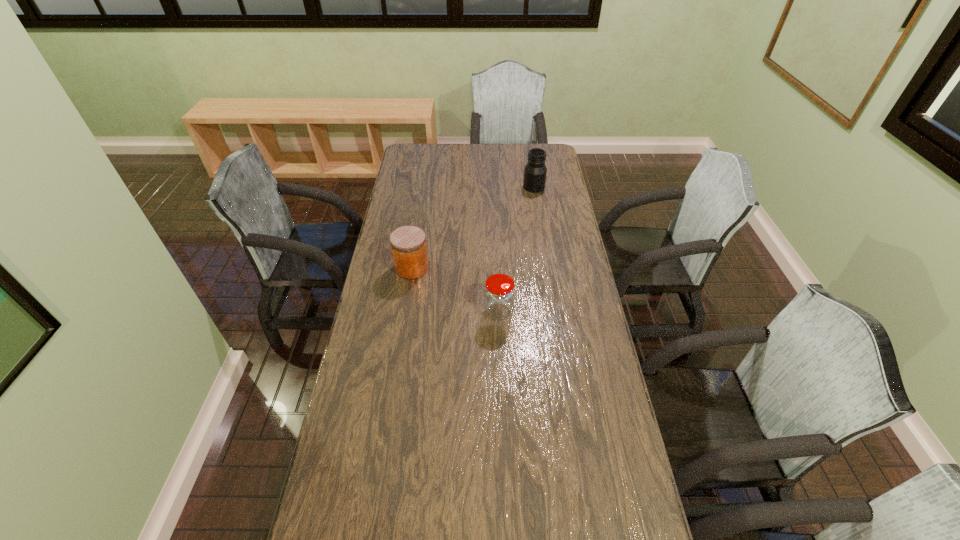
Where is `object that is the second closest to the second object from right to left`? This screenshot has height=540, width=960. object that is the second closest to the second object from right to left is located at coordinates (535, 171).

At what (x,y) coordinates should I click in order to perform the action: click on jar that is the second closest one to the rightmost jar. Please return your answer as a coordinate pair (x, y). Image resolution: width=960 pixels, height=540 pixels. Looking at the image, I should click on (499, 293).

This screenshot has height=540, width=960. Find the location of `the second closest jar relative to the farthest jar`. the second closest jar relative to the farthest jar is located at coordinates (499, 293).